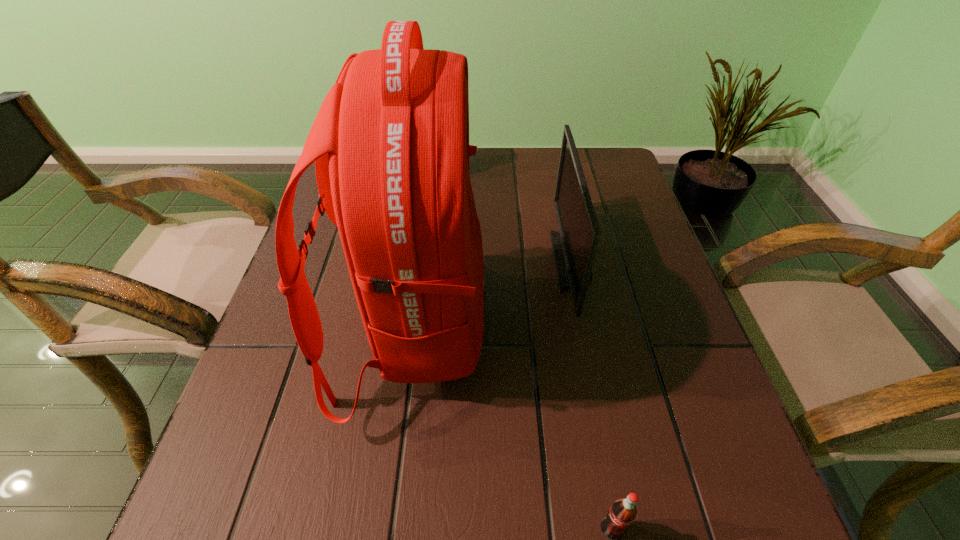
Where is `vacant area at the near left corner`? Image resolution: width=960 pixels, height=540 pixels. vacant area at the near left corner is located at coordinates tap(204, 513).

Where is `vacant area between the leftmost object and the monitor`? vacant area between the leftmost object and the monitor is located at coordinates (492, 293).

Locate an element on the screen. The width and height of the screenshot is (960, 540). free space between the monitor and the backpack is located at coordinates (492, 293).

Choose which object is the second nearest neighbor to the leftmost object. Please provide its 2D coordinates. Your answer should be formatted as a tuple, i.e. [(x, y)], where the tuple contains the x and y coordinates of a point satisfying the conditions above.

[(623, 511)]

This screenshot has height=540, width=960. Find the location of `the closest object to the soda bottle`. the closest object to the soda bottle is located at coordinates (390, 142).